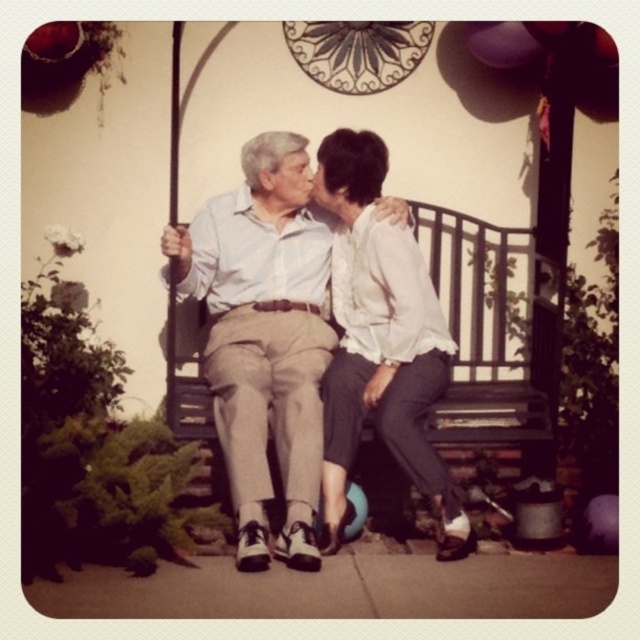
You are a photographer trying to capture a closeup of the light beige cotton pants at center and the white satin blouse at upper right. Which object should you focus on first if you want to ensure both are in focus?

The light beige cotton pants at center is below the white satin blouse at upper right, so you should focus on the white satin blouse at upper right first to ensure both are in focus since it is closer to the camera.

You are a photographer trying to capture a closeup of the white satin blouse at upper right. However, the light beige cotton pants at center are blocking your view. Can you adjust your position to take the photo without moving the subjects?

The light beige cotton pants at center is in front of the white satin blouse at upper right, so you can move your camera position to the side or angle it so that you can capture the white satin blouse at upper right without the obstruction from the light beige cotton pants at center.